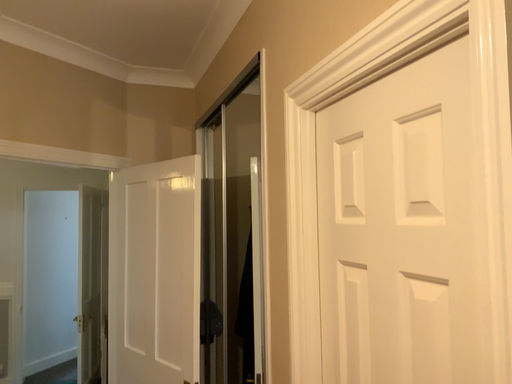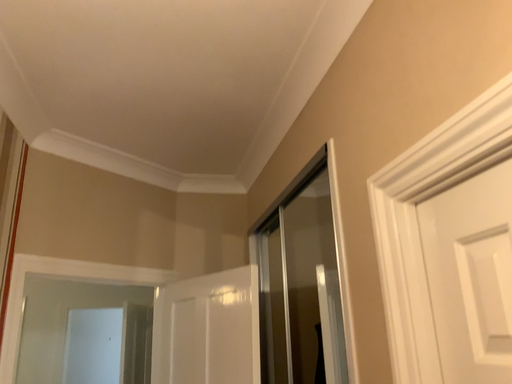
Question: Which way did the camera rotate in the video?

Choices:
 (A) rotated left
 (B) rotated right

Answer: (A)